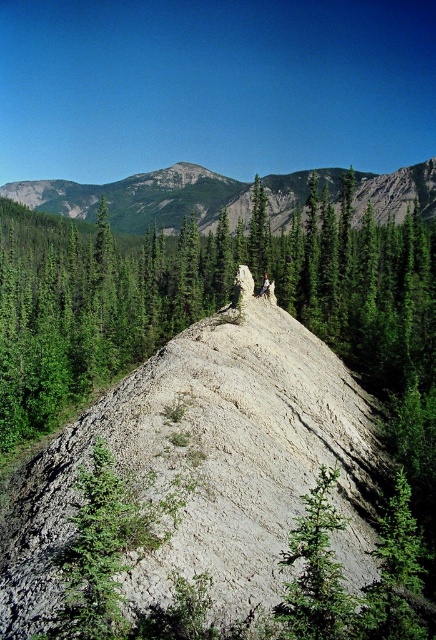
Can you confirm if rocky mountain at center is thinner than green rough textured tree at center?

No, rocky mountain at center is not thinner than green rough textured tree at center.

Can you confirm if rocky mountain at center is positioned above green rough textured tree at center?

Correct, rocky mountain at center is located above green rough textured tree at center.

The width and height of the screenshot is (436, 640). I want to click on rocky mountain at center, so (143, 198).

Who is positioned more to the left, green rough textured tree at center or camouflage fabric hiker at center?

green rough textured tree at center is more to the left.

Does green rough textured tree at center appear over camouflage fabric hiker at center?

Actually, green rough textured tree at center is below camouflage fabric hiker at center.

Between point (313, 520) and point (268, 284), which one is positioned in front?

Point (313, 520) is more forward.

This screenshot has height=640, width=436. What are the coordinates of `green rough textured tree at center` in the screenshot? It's located at (316, 572).

Who is higher up, rocky mountain at center or camouflage fabric hiker at center?

rocky mountain at center is above.

Which is in front, point (384, 216) or point (269, 280)?

Point (269, 280) is in front.

Measure the distance between point [98,189] and camera.

Point [98,189] is 1654.26 feet from camera.

In order to click on rocky mountain at center in this screenshot , I will do `click(143, 198)`.